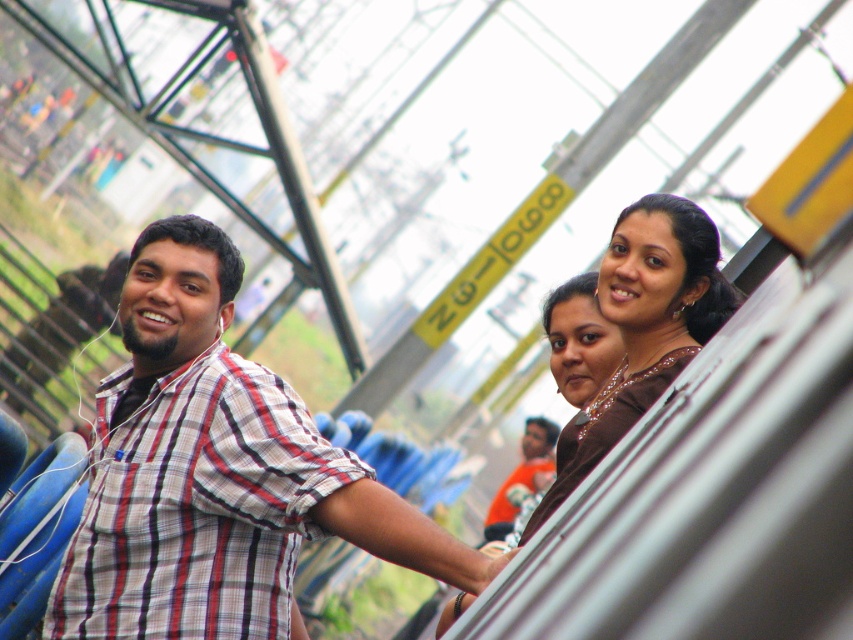
Does point (256, 458) come closer to viewer compared to point (506, 481)?

Yes.

Is point (230, 531) behind point (509, 481)?

No, (230, 531) is closer to viewer.

Where is `plaid cotton shirt at left`? Image resolution: width=853 pixels, height=640 pixels. plaid cotton shirt at left is located at coordinates (196, 506).

Is plaid cotton shirt at left smaller than brown satin dress at upper right?

Indeed, plaid cotton shirt at left has a smaller size compared to brown satin dress at upper right.

Between plaid cotton shirt at left and brown satin dress at upper right, which one appears on the right side from the viewer's perspective?

From the viewer's perspective, brown satin dress at upper right appears more on the right side.

From the picture: Who is more forward, (91,605) or (670,227)?

Point (91,605) is more forward.

Find the location of a particular element. The height and width of the screenshot is (640, 853). plaid cotton shirt at left is located at coordinates (196, 506).

Looking at this image, is plaid shirt at left taller than orange shirt at center?

Incorrect, plaid shirt at left's height is not larger of orange shirt at center's.

Is point (117, 449) positioned after point (505, 500)?

That is False.

Identify the location of plaid shirt at left. Image resolution: width=853 pixels, height=640 pixels. (216, 474).